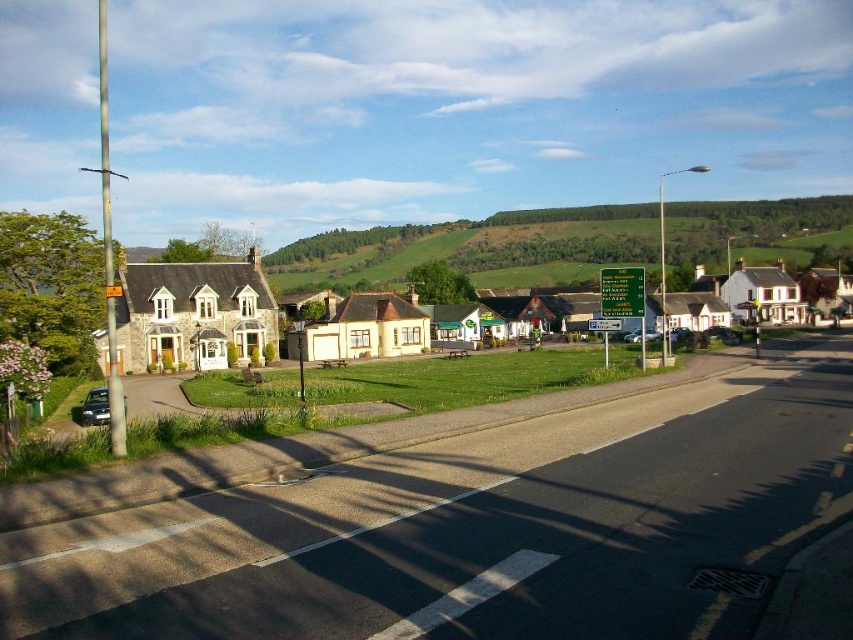
Between point (206, 285) and point (97, 412), which one is positioned in front?

Point (97, 412) is more forward.

Can you confirm if stone house at center is bigger than metallic silver car at lower left?

Correct, stone house at center is larger in size than metallic silver car at lower left.

Image resolution: width=853 pixels, height=640 pixels. What are the coordinates of `stone house at center` in the screenshot? It's located at (260, 317).

Is green plastic sign at center to the right of green plastic sign at upper center from the viewer's perspective?

Correct, you'll find green plastic sign at center to the right of green plastic sign at upper center.

Who is higher up, green plastic sign at center or green plastic sign at upper center?

green plastic sign at center is above.

Who is more distant from viewer, (628, 275) or (595, 321)?

The point (595, 321) is behind.

The image size is (853, 640). What are the coordinates of `green plastic sign at center` in the screenshot? It's located at (621, 291).

Does stone house at center have a smaller size compared to green plastic sign at center?

Actually, stone house at center might be larger than green plastic sign at center.

Describe the element at coordinates (260, 317) in the screenshot. I see `stone house at center` at that location.

Does point (276, 323) lie in front of point (601, 289)?

No.

Identify the location of stone house at center. (260, 317).